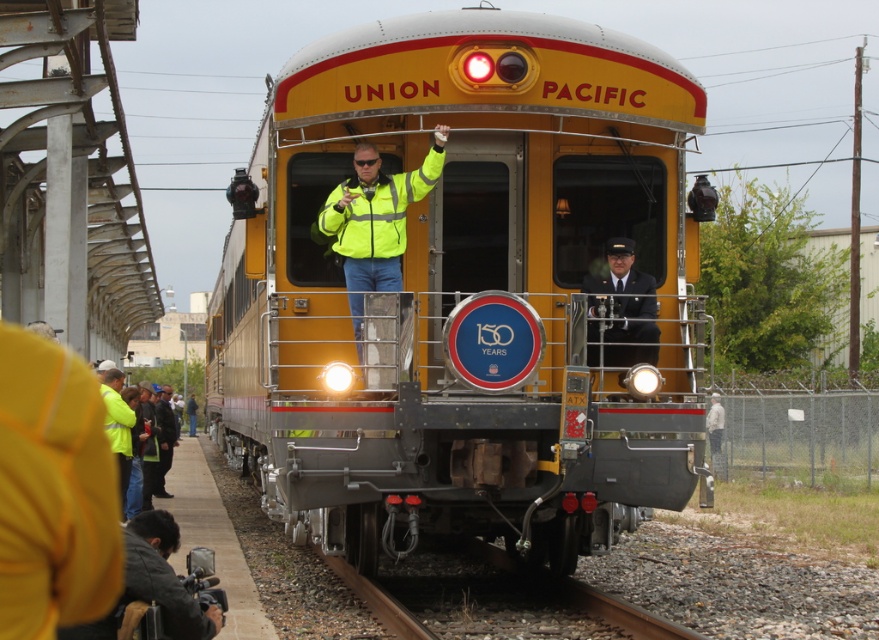
You are a passenger on the train and want to locate the conductor who is wearing a dark blue uniform at center. From your current position at the yellow polished metal train at center, which direction should you move to find the conductor?

The yellow polished metal train at center is to the left of the dark blue uniform at center, so you should move to your right to locate the conductor wearing the dark blue uniform at center.

You are a passenger on the train and want to identify which staff member is closer to the front of the train car. The staff members are wearing a neon yellow reflective jacket at center and a dark blue uniform at center. Based on their positions, which one is positioned closer to the front?

The neon yellow reflective jacket at center is taller than the dark blue uniform at center, so the neon yellow reflective jacket at center is positioned closer to the front of the train car.